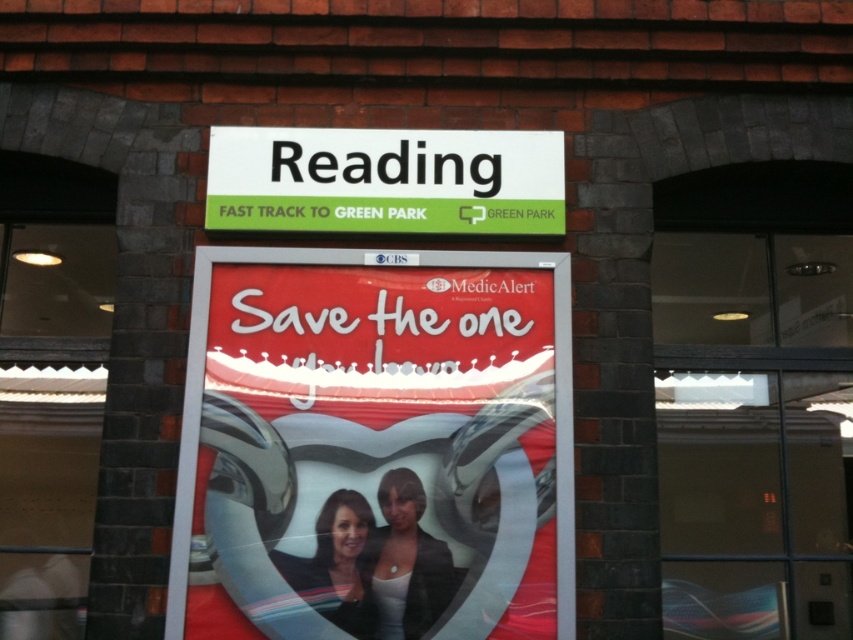
Question: Does white plastic sign at upper center lie behind matte black jacket at center?

Choices:
 (A) no
 (B) yes

Answer: (B)

Question: Is transparent glass door at center to the right of smooth black hair at center from the viewer's perspective?

Choices:
 (A) yes
 (B) no

Answer: (A)

Question: Which object is positioned farthest from the smooth black hair at center?

Choices:
 (A) transparent glass door at center
 (B) white plastic sign at upper center
 (C) matte black jacket at center
 (D) matte plastic poster at center

Answer: (A)

Question: Is matte plastic poster at center wider than white plastic sign at upper center?

Choices:
 (A) no
 (B) yes

Answer: (B)

Question: Which object is closer to the camera taking this photo?

Choices:
 (A) smooth black hair at center
 (B) matte black jacket at center
 (C) white plastic sign at upper center
 (D) transparent glass door at center

Answer: (B)

Question: Which point is closer to the camera?

Choices:
 (A) (450, 221)
 (B) (430, 620)

Answer: (B)